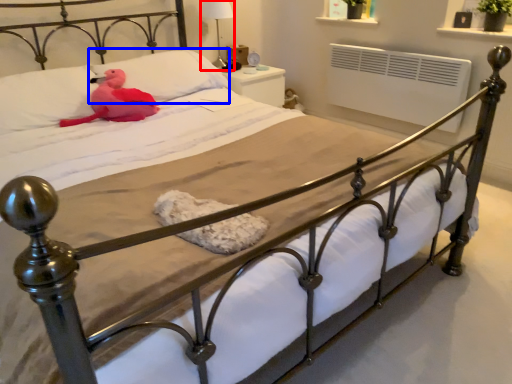
Question: Which point is further to the camera, table lamp (highlighted by a red box) or pillow (highlighted by a blue box)?

Choices:
 (A) table lamp
 (B) pillow

Answer: (A)